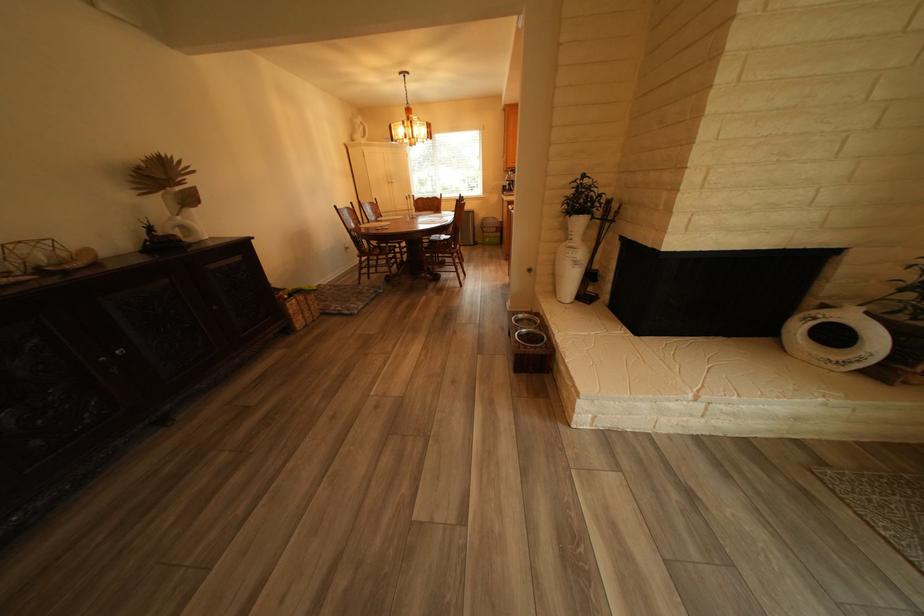
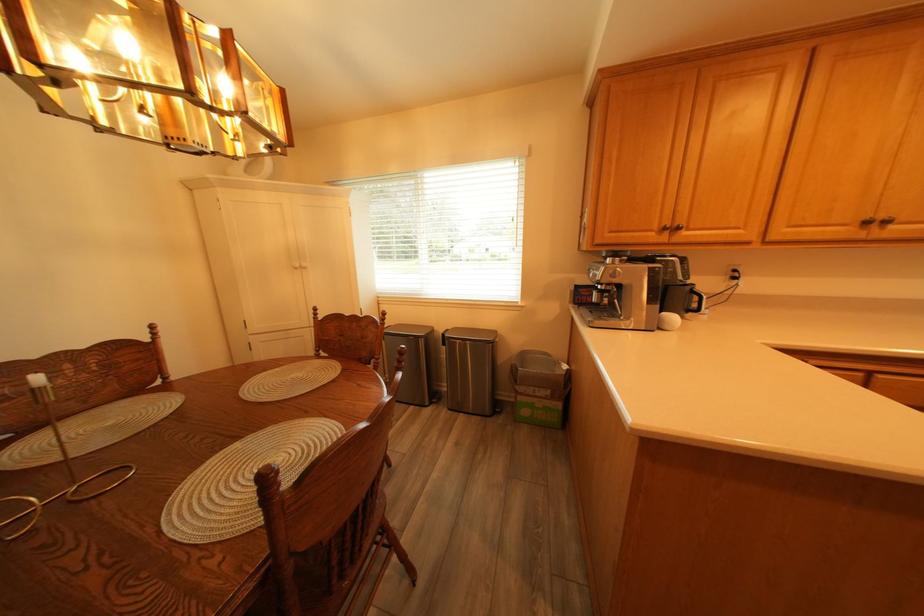
Question: What movement of the cameraman would produce the second image?

Choices:
 (A) Left
 (B) Right
 (C) Forward
 (D) Backward

Answer: (C)